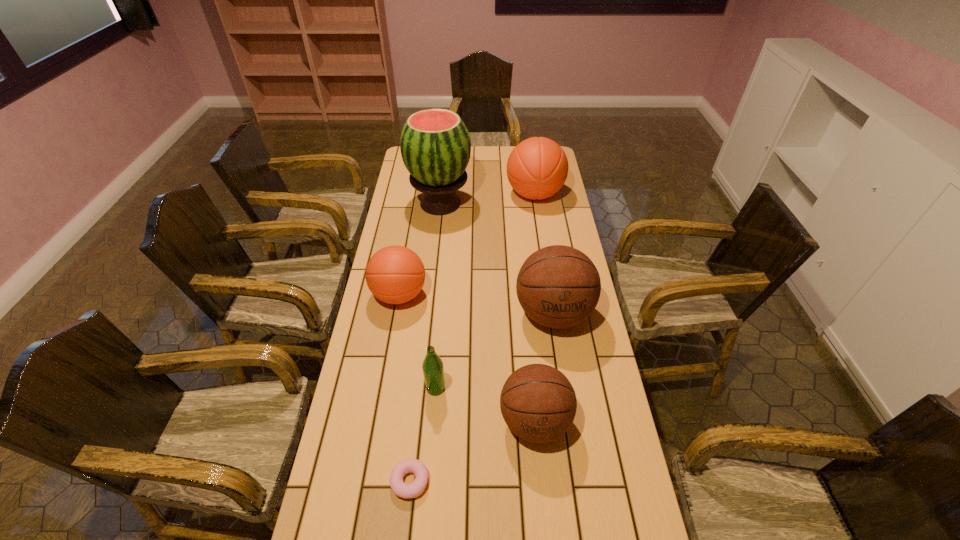
This screenshot has height=540, width=960. I want to click on the tallest object, so click(435, 145).

Find the location of `watermelon`. watermelon is located at coordinates (435, 145).

Locate an element on the screen. The height and width of the screenshot is (540, 960). the farther orange basketball is located at coordinates (537, 168).

Locate an element on the screen. This screenshot has width=960, height=540. the right orange basketball is located at coordinates (537, 168).

Find the location of a particular element. This screenshot has height=540, width=960. the bigger brown basketball is located at coordinates (558, 286).

Image resolution: width=960 pixels, height=540 pixels. In order to click on the left orange basketball in this screenshot , I will do `click(395, 274)`.

What are the coordinates of `the leftmost basketball` in the screenshot? It's located at (395, 274).

At what (x,y) coordinates should I click in order to perform the action: click on the smaller brown basketball. Please return your answer as a coordinate pair (x, y). Looking at the image, I should click on (538, 403).

The height and width of the screenshot is (540, 960). What are the coordinates of `the nearer brown basketball` in the screenshot? It's located at (538, 403).

Where is `green bottle`? The width and height of the screenshot is (960, 540). green bottle is located at coordinates (433, 369).